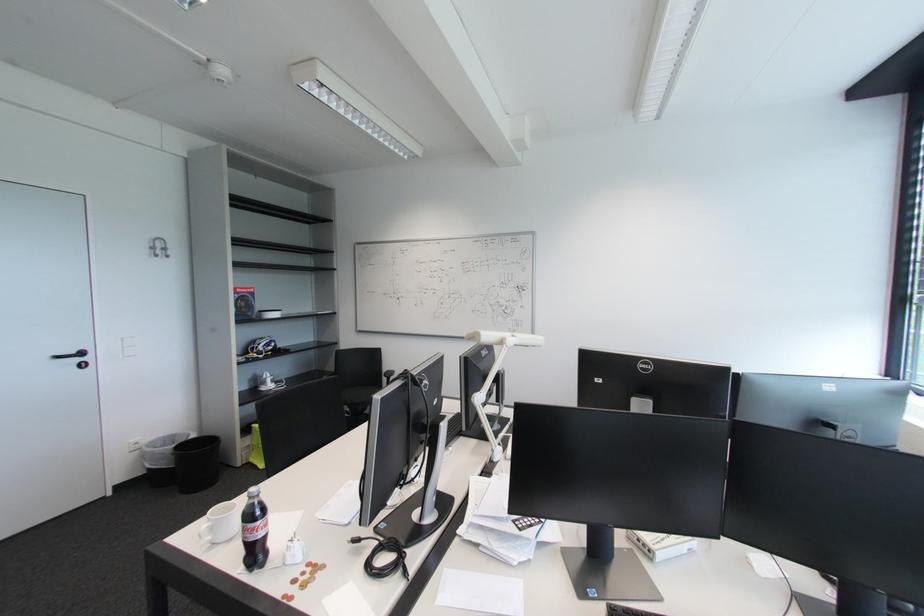
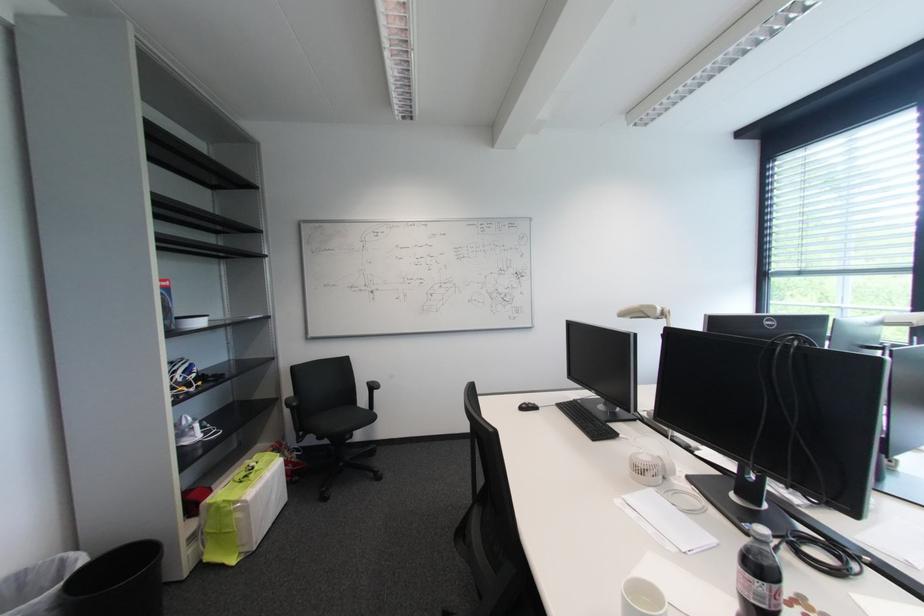
Locate, in the second image, the point that corresponds to (265,346) in the first image.

(181, 373)